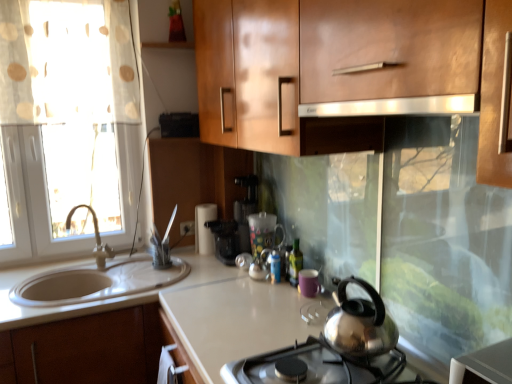
Locate an element on the screen. vacant area to the left of translucent glass mug at center, placed as the second appliance when sorted from left to right is located at coordinates (223, 273).